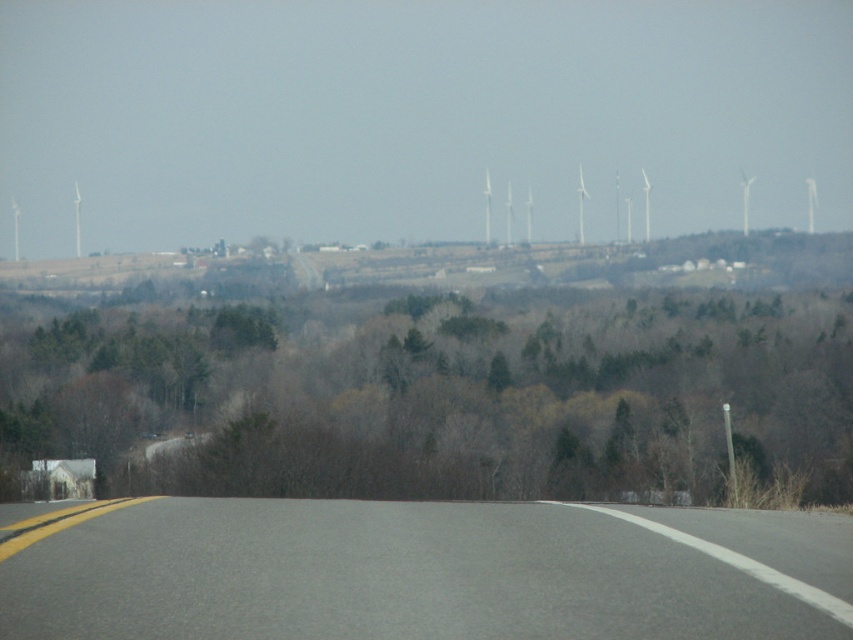
Question: Among these objects, which one is farthest from the camera?

Choices:
 (A) white plastic wind turbines at upper center
 (B) brown/dry wood trees at center
 (C) gray asphalt road at center
 (D) white plastic windmill at upper center

Answer: (D)

Question: Does brown/dry wood trees at center have a larger size compared to gray asphalt road at center?

Choices:
 (A) no
 (B) yes

Answer: (B)

Question: Which is farther from the white plastic wind turbines at upper center?

Choices:
 (A) gray asphalt road at center
 (B) brown/dry wood trees at center

Answer: (A)

Question: Is brown/dry wood trees at center smaller than gray asphalt road at center?

Choices:
 (A) no
 (B) yes

Answer: (A)

Question: Which point appears farthest from the camera in this image?

Choices:
 (A) (793, 304)
 (B) (485, 192)
 (C) (78, 225)
 (D) (61, 636)

Answer: (C)

Question: In this image, where is gray asphalt road at center located relative to white plastic wind turbines at upper center?

Choices:
 (A) right
 (B) left

Answer: (B)